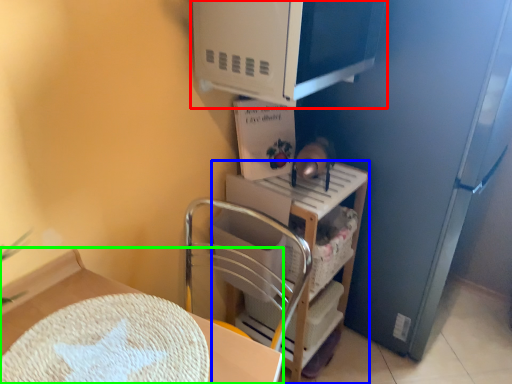
Question: Which object is positioned closest to appliance (highlighted by a red box)? Select from shelf (highlighted by a blue box) and furniture (highlighted by a green box).

Choices:
 (A) shelf
 (B) furniture

Answer: (A)